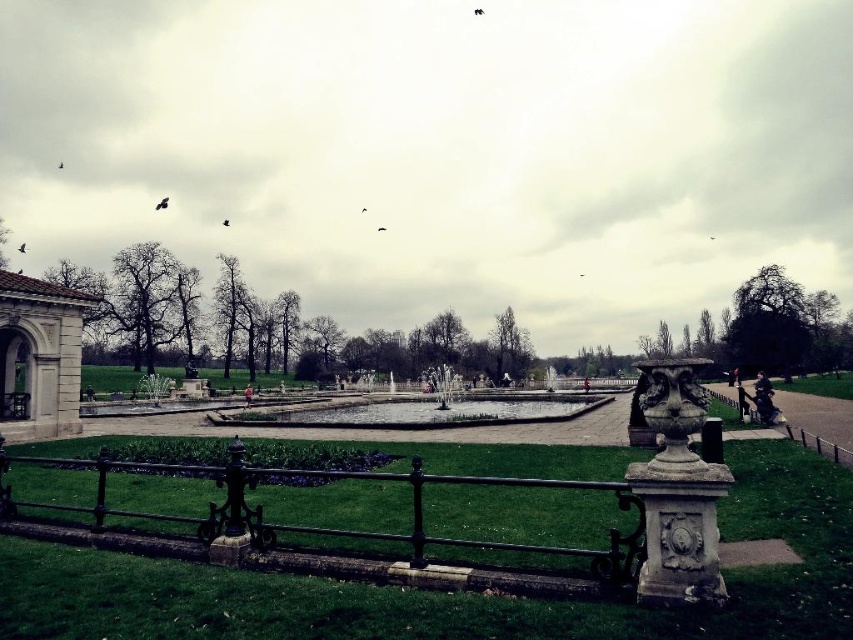
Question: Is black wrought iron fence at lower center thinner than clear glass pond at center?

Choices:
 (A) yes
 (B) no

Answer: (A)

Question: Among these points, which one is nearest to the camera?

Choices:
 (A) (16, 305)
 (B) (308, 410)

Answer: (A)

Question: Does white stone arch at left lie in front of clear glass pond at center?

Choices:
 (A) yes
 (B) no

Answer: (A)

Question: Does black wrought iron fence at lower center appear over white stone arch at left?

Choices:
 (A) no
 (B) yes

Answer: (A)

Question: Which of the following is the closest to the observer?

Choices:
 (A) white stone arch at left
 (B) clear glass pond at center
 (C) black wrought iron fence at lower center

Answer: (C)

Question: Which of the following is the farthest from the observer?

Choices:
 (A) pos(320,410)
 (B) pos(25,429)

Answer: (A)